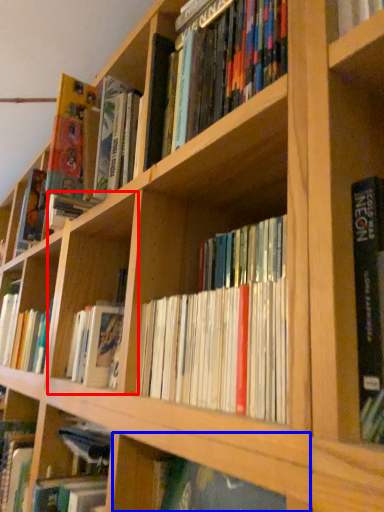
Question: Which of the following is the closest to the observer, cabinet (highlighted by a red box) or shelf (highlighted by a blue box)?

Choices:
 (A) cabinet
 (B) shelf

Answer: (B)